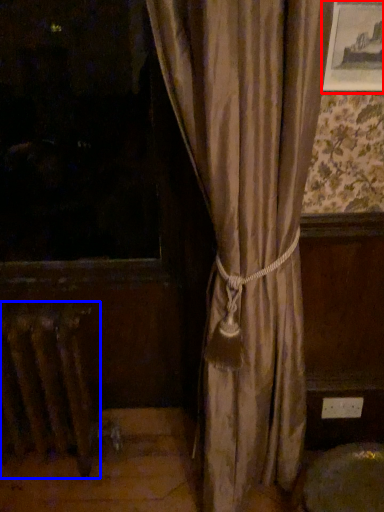
Question: Which of the following is the farthest to the observer, picture frame (highlighted by a red box) or radiator (highlighted by a blue box)?

Choices:
 (A) picture frame
 (B) radiator

Answer: (B)